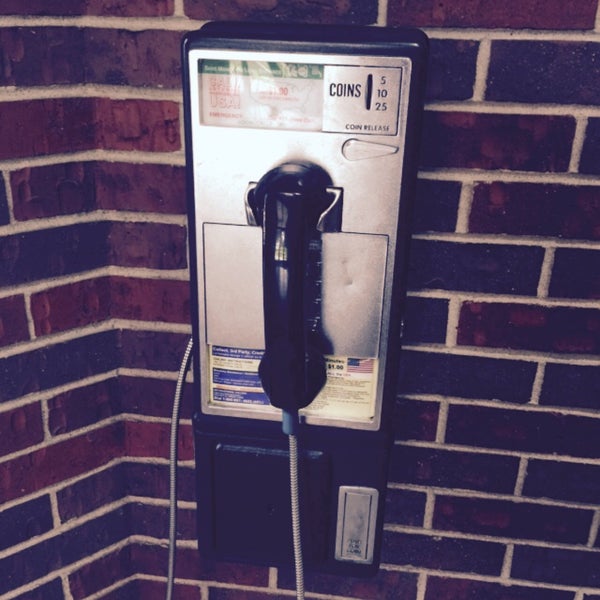
Find the location of a particular element. grout is located at coordinates (453, 351).